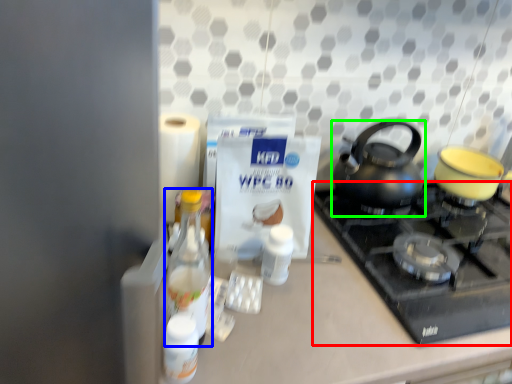
Question: Which object is positioned farthest from gas stove (highlighted by a red box)? Select from bottle (highlighted by a blue box) and kettle (highlighted by a green box).

Choices:
 (A) bottle
 (B) kettle

Answer: (A)